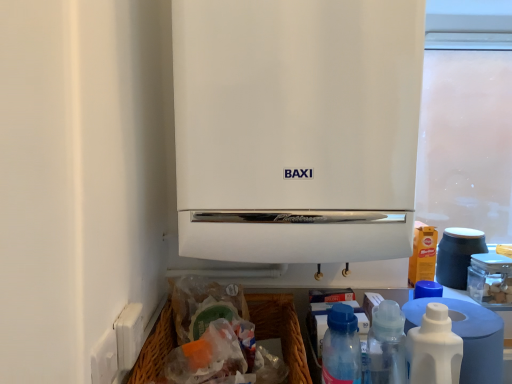
Question: Does blue translucent bottle at lower right, which appears as the 2th bottle when viewed from the right, lie in front of matte blue cup at right?

Choices:
 (A) yes
 (B) no

Answer: (A)

Question: Is the depth of blue translucent bottle at lower right, which appears as the 2th bottle when viewed from the right, greater than that of matte blue cup at right?

Choices:
 (A) yes
 (B) no

Answer: (B)

Question: Can you confirm if blue translucent bottle at lower right, which appears as the 2th bottle when viewed from the right, is taller than matte blue cup at right?

Choices:
 (A) no
 (B) yes

Answer: (B)

Question: Is blue translucent bottle at lower right, which appears as the 2th bottle when viewed from the right, outside of matte blue cup at right?

Choices:
 (A) no
 (B) yes

Answer: (B)

Question: Are blue translucent bottle at lower right, which appears as the 2th bottle when viewed from the right, and matte blue cup at right far apart?

Choices:
 (A) yes
 (B) no

Answer: (B)

Question: Is blue translucent bottle at lower right, arranged as the first bottle when viewed from the left, looking in the opposite direction of matte blue cup at right?

Choices:
 (A) yes
 (B) no

Answer: (B)

Question: From the image's perspective, is blue translucent bottle at lower right, which appears as the 2th bottle when viewed from the right, under white matte boiler at center?

Choices:
 (A) no
 (B) yes

Answer: (B)

Question: Is blue translucent bottle at lower right, arranged as the first bottle when viewed from the left, positioned in front of white matte boiler at center?

Choices:
 (A) yes
 (B) no

Answer: (A)

Question: From a real-world perspective, is blue translucent bottle at lower right, which appears as the 2th bottle when viewed from the right, located higher than white matte boiler at center?

Choices:
 (A) yes
 (B) no

Answer: (B)

Question: From a real-world perspective, is blue translucent bottle at lower right, which appears as the 2th bottle when viewed from the right, located beneath white matte boiler at center?

Choices:
 (A) yes
 (B) no

Answer: (A)

Question: Can you confirm if blue translucent bottle at lower right, which appears as the 2th bottle when viewed from the right, is thinner than white matte boiler at center?

Choices:
 (A) no
 (B) yes

Answer: (B)

Question: Would you consider blue translucent bottle at lower right, which appears as the 2th bottle when viewed from the right, to be distant from white matte boiler at center?

Choices:
 (A) yes
 (B) no

Answer: (B)

Question: Is matte blue cup at right surrounding blue translucent bottle at lower right, arranged as the first bottle when viewed from the left?

Choices:
 (A) no
 (B) yes

Answer: (A)